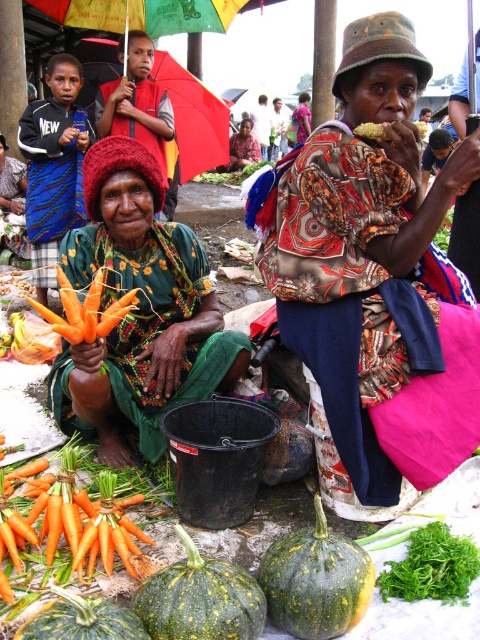
Does green rough squash at lower center come in front of green leafy at center?

Yes, green rough squash at lower center is closer to the viewer.

Between point (275, 588) and point (418, 588), which one is positioned behind?

The point (418, 588) is behind.

Between point (357, 605) and point (475, 572), which one is positioned in front?

Point (357, 605) is in front.

This screenshot has width=480, height=640. In order to click on green rough squash at lower center in this screenshot , I will do `click(315, 580)`.

Which is above, green textured squash at center or green leafy at center?

green textured squash at center is higher up.

Can you confirm if green textured squash at center is thinner than green leafy at center?

In fact, green textured squash at center might be wider than green leafy at center.

This screenshot has width=480, height=640. In order to click on green textured squash at center in this screenshot , I will do `click(201, 600)`.

Locate an element on the screen. Image resolution: width=480 pixels, height=640 pixels. green textured squash at center is located at coordinates (201, 600).

Does green textured squash at center appear on the left side of orange smooth carrot at lower left?

Incorrect, green textured squash at center is not on the left side of orange smooth carrot at lower left.

Consider the image. Does green textured squash at center appear on the right side of orange smooth carrot at lower left?

Correct, you'll find green textured squash at center to the right of orange smooth carrot at lower left.

Measure the distance between point (191,596) and camera.

They are 1.50 meters apart.

This screenshot has width=480, height=640. Identify the location of green textured squash at center. (201, 600).